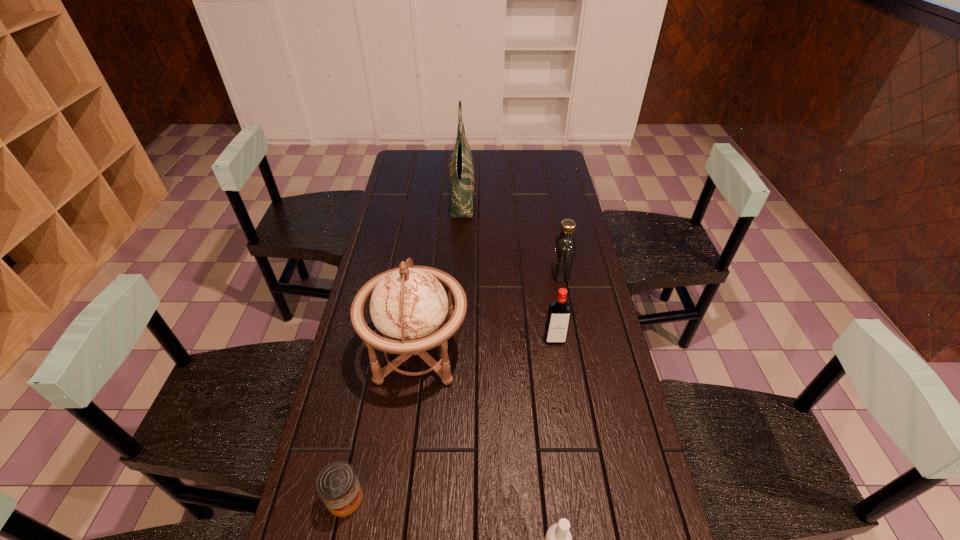
In the image, there is a desktop. Where is `free space at the far right corner`? The width and height of the screenshot is (960, 540). free space at the far right corner is located at coordinates [558, 163].

At what (x,y) coordinates should I click in order to perform the action: click on free space between the second farthest object and the globe. Please return your answer as a coordinate pair (x, y). Image resolution: width=960 pixels, height=540 pixels. Looking at the image, I should click on (489, 313).

In order to click on free point between the globe and the second nearest vodka in this screenshot , I will do `click(486, 346)`.

What are the coordinates of `unoccupied position between the globe and the second nearest vodka` in the screenshot? It's located at (486, 346).

Where is `free space between the farthest object and the second farthest object`? Image resolution: width=960 pixels, height=540 pixels. free space between the farthest object and the second farthest object is located at coordinates (511, 235).

Find the location of `vacant space that is in between the second nearest vodka and the farthest object`. vacant space that is in between the second nearest vodka and the farthest object is located at coordinates (508, 268).

Identify the location of empty space between the can and the second nearest vodka. The height and width of the screenshot is (540, 960). (x=450, y=419).

Identify the location of the closest object to the leftmost vodka. (409, 306).

Locate which object is the closest to the can. Please provide its 2D coordinates. Your answer should be formatted as a tuple, i.e. [(x, y)], where the tuple contains the x and y coordinates of a point satisfying the conditions above.

[(409, 306)]

At what (x,y) coordinates should I click in order to perform the action: click on the second closest vodka to the second nearest vodka. Please return your answer as a coordinate pair (x, y). The width and height of the screenshot is (960, 540). Looking at the image, I should click on (558, 539).